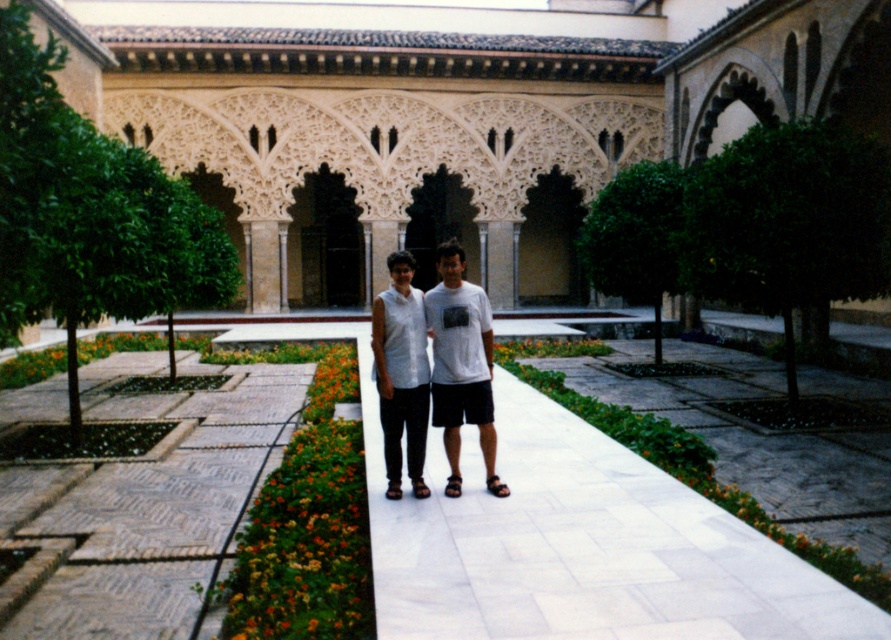
You are standing in the courtyard and want to take a photo of the white stone arches at center. If your camera has a maximum focus range of 12 meters, will you need to move closer to capture them clearly?

The white stone arches at center are 13.57 meters away from the viewer. Since this exceeds the camera maximum focus range of 12 meters, you need to move closer to ensure they are in focus.

You are a visitor in this courtyard and want to take a photo of the white cotton shirt at center and the white stone arches at center in the background. To ensure both are in focus, where should you position the shirt relative to the arches?

The white cotton shirt at center is to the left of the white stone arches at center, so you should position the shirt to the left side of the arches to capture both in focus.